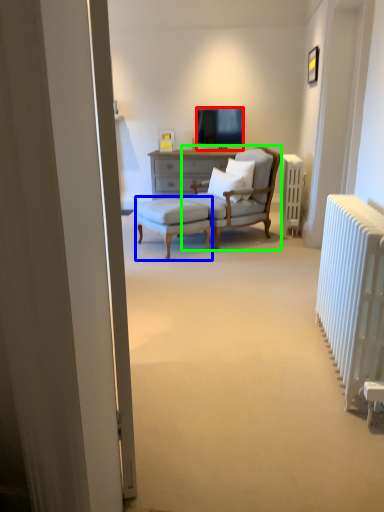
Question: Which object is the farthest from television (highlighted by a red box)? Choose among these: stool (highlighted by a blue box) or chair (highlighted by a green box).

Choices:
 (A) stool
 (B) chair

Answer: (A)